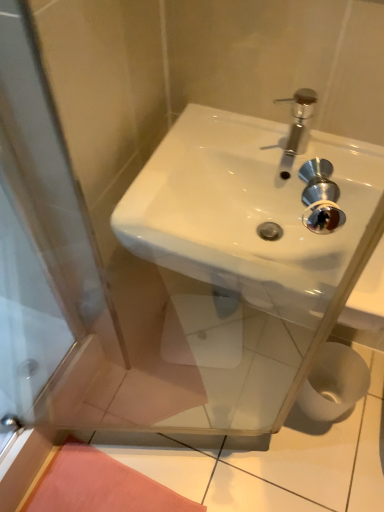
Identify the location of free space in front of white matte toilet paper at lower right. This screenshot has height=512, width=384. (341, 453).